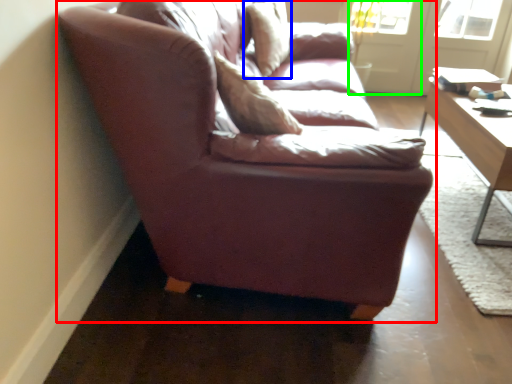
Question: Which object is the farthest from studio couch (highlighted by a red box)? Choose among these: pillow (highlighted by a blue box) or screen door (highlighted by a green box).

Choices:
 (A) pillow
 (B) screen door

Answer: (B)